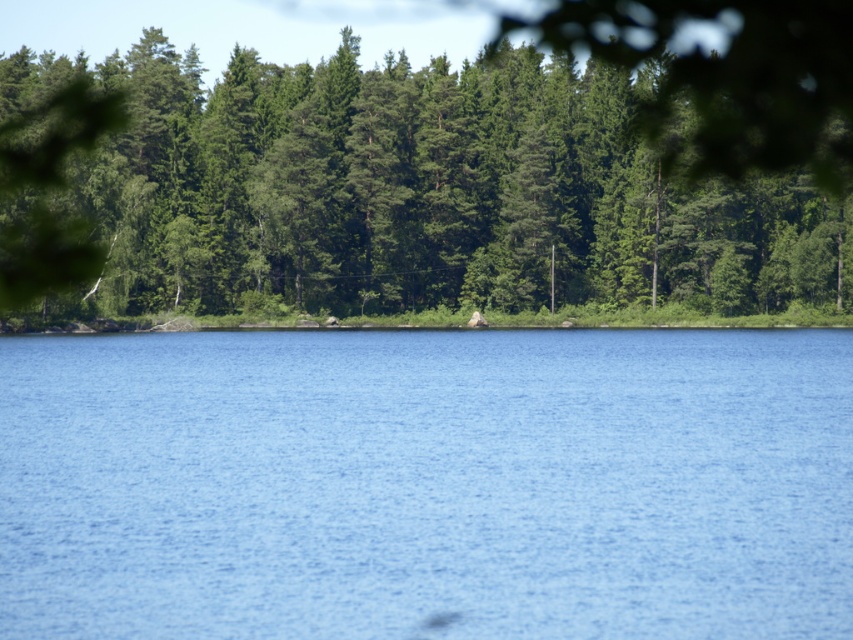
You are a bird flying over a serene landscape. You see the blue water at center and the green leafy trees at upper center. Which object is located below the other?

The blue water at center is positioned under the green leafy trees at upper center, so the blue water at center is below the green leafy trees at upper center.

You are standing at the edge of the blue water at center and looking towards the green leafy trees at upper center. Which object is taller when comparing their heights?

The green leafy trees at upper center are taller than the blue water at center.